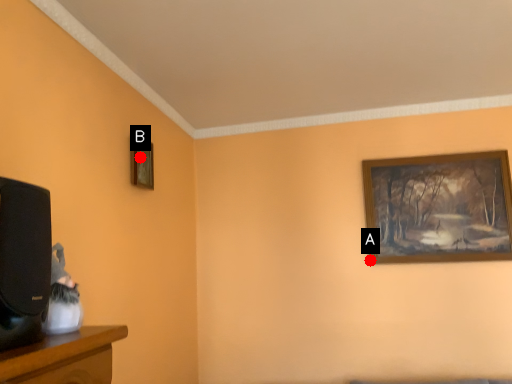
Question: Two points are circled on the image, labeled by A and B beside each circle. Which point appears farthest from the camera in this image?

Choices:
 (A) A is further
 (B) B is further

Answer: (A)